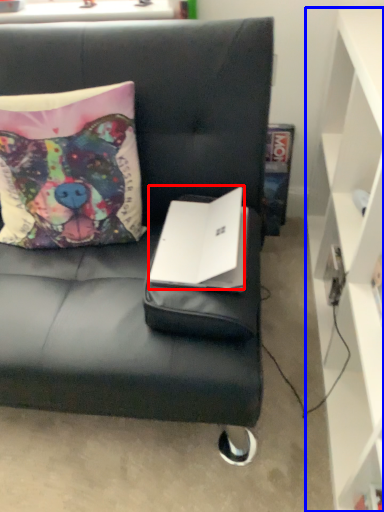
Question: Which point is closer to the camera, laptop (highlighted by a red box) or cabinetry (highlighted by a blue box)?

Choices:
 (A) laptop
 (B) cabinetry

Answer: (B)